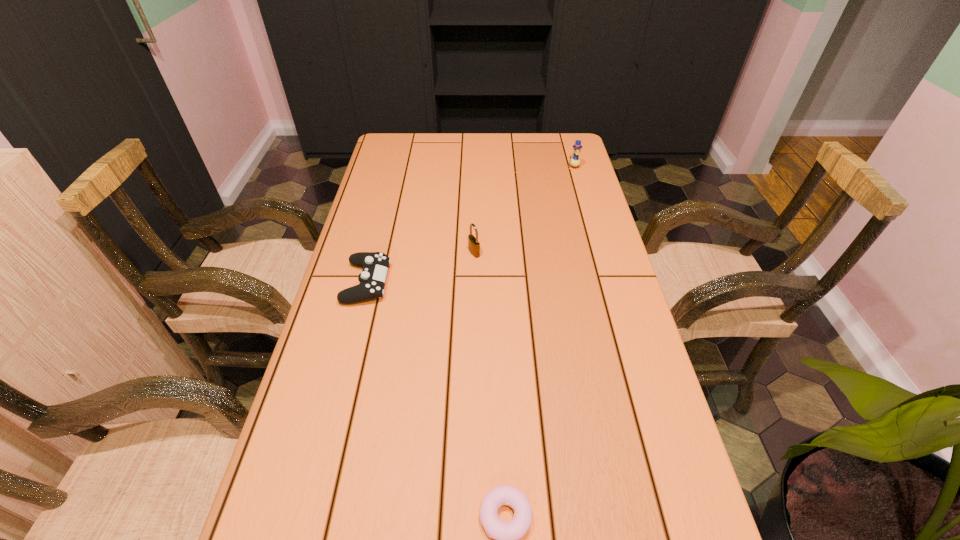
Find the location of `object positioned at the right edge`. object positioned at the right edge is located at coordinates (575, 161).

Find the location of a particular element. The width and height of the screenshot is (960, 540). object present at the far right corner is located at coordinates (575, 161).

Identify the location of vacant space at the far edge of the desktop. (481, 157).

Find the location of a particular element. The height and width of the screenshot is (540, 960). vacant space at the left edge of the desktop is located at coordinates (340, 343).

The height and width of the screenshot is (540, 960). In the image, there is a desktop. In order to click on vacant region at the right edge in this screenshot , I will do `click(687, 503)`.

This screenshot has width=960, height=540. Identify the location of free region at the far right corner. (560, 142).

I want to click on empty space that is in between the control and the padlock, so click(x=420, y=267).

Locate an element on the screen. This screenshot has height=540, width=960. vacant space that's between the duckling and the padlock is located at coordinates (524, 210).

At what (x,y) coordinates should I click in order to perform the action: click on free space between the padlock and the duckling. Please return your answer as a coordinate pair (x, y). Looking at the image, I should click on [x=524, y=210].

This screenshot has height=540, width=960. In order to click on the third closest object to the farthest object in this screenshot , I will do `click(507, 534)`.